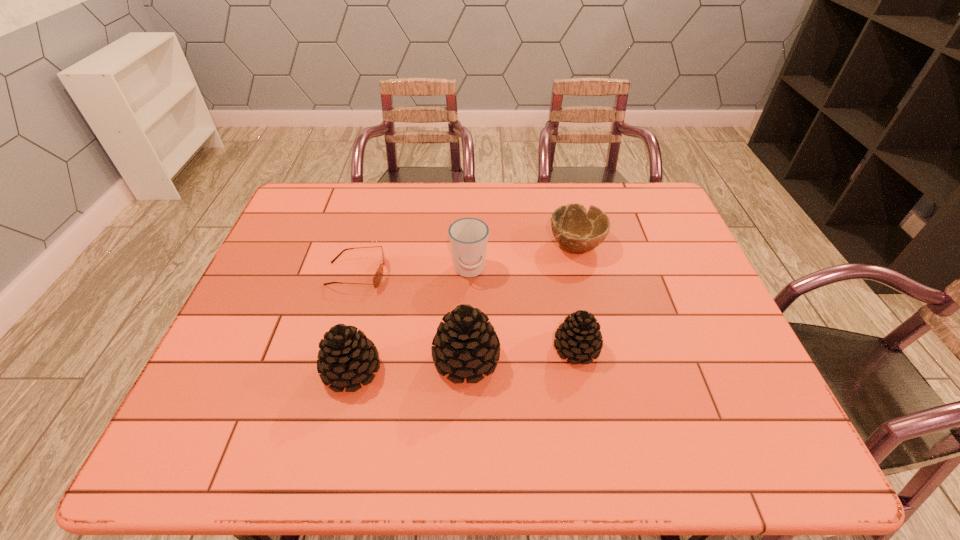
Where is `vacant area that lies between the cup and the bowl`? vacant area that lies between the cup and the bowl is located at coordinates (523, 258).

At what (x,y) coordinates should I click in order to perform the action: click on free space between the bowl and the cup. Please return your answer as a coordinate pair (x, y). This screenshot has height=540, width=960. Looking at the image, I should click on (523, 258).

This screenshot has width=960, height=540. In order to click on empty space between the cup and the shortest pinecone in this screenshot , I will do `click(523, 309)`.

You are a GUI agent. You are given a task and a screenshot of the screen. Output one action in this format:
    pyautogui.click(x=<x>, y=<y>)
    Task: Click on the free space that is in between the bowl and the cup
    The image size is (960, 540).
    Given the screenshot: What is the action you would take?
    pyautogui.click(x=523, y=258)

Choose which object is the fifth nearest neighbor to the fifth tallest object. Please provide its 2D coordinates. Your answer should be formatted as a tuple, i.e. [(x, y)], where the tuple contains the x and y coordinates of a point satisfying the conditions above.

[(346, 357)]

In order to click on object that is the fourth closest to the fifth tallest object in this screenshot , I will do `click(377, 278)`.

Image resolution: width=960 pixels, height=540 pixels. Find the location of `pinecone that is the third closest to the cup`. pinecone that is the third closest to the cup is located at coordinates (346, 357).

Select which pinecone is the closest to the shortest pinecone. Please provide its 2D coordinates. Your answer should be formatted as a tuple, i.e. [(x, y)], where the tuple contains the x and y coordinates of a point satisfying the conditions above.

[(466, 344)]

This screenshot has height=540, width=960. I want to click on vacant region that satisfies the following two spatial constraints: 1. with a handle on the side of the cup; 2. at the narrow end of the second pinecone from right to left, so click(468, 359).

Locate an element on the screen. vacant space that satisfies the following two spatial constraints: 1. with a handle on the side of the cup; 2. on the front-facing side of the sunglasses is located at coordinates (469, 274).